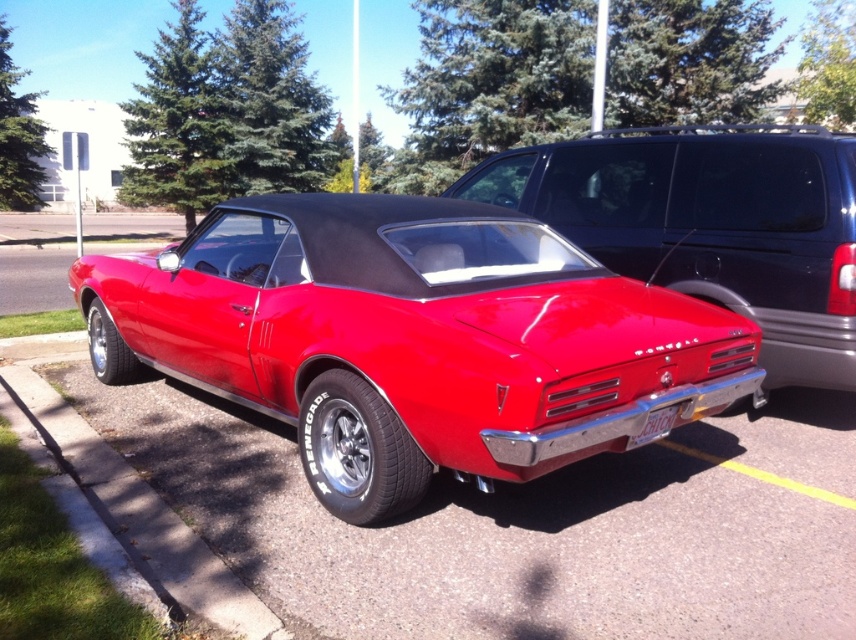
You are a parking attendant and need to fit both the shiny red car at center and the glossy black suv at upper right into a parking spot that is 2.5 meters wide. Based on their widths, can both vehicles fit side by side in the spot?

The shiny red car at center might be wider than glossy black suv at upper right, so it is uncertain if both can fit side by side in a 2.5 meter wide spot without overlapping.

You are a delivery person who needs to deliver a package to the shiny red car at center. The package must be placed on the white plastic license plate at rear. However, the delivery robot you are using has a maximum reach of 4 feet. Can the robot place the package directly onto the license plate without moving closer?

The shiny red car at center and white plastic license plate at rear are 4.79 feet apart from each other. Since the robot can only reach up to 4 feet, it cannot place the package directly onto the license plate without moving closer.